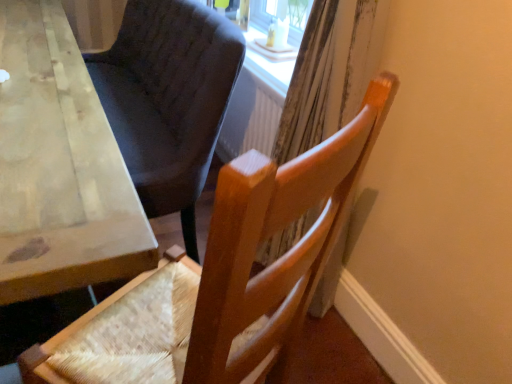
Question: Does wooden chair at center have a larger size compared to wooden table at left?

Choices:
 (A) no
 (B) yes

Answer: (A)

Question: Is wooden chair at center facing away from wooden table at left?

Choices:
 (A) yes
 (B) no

Answer: (B)

Question: Does wooden chair at center lie in front of wooden table at left?

Choices:
 (A) no
 (B) yes

Answer: (B)

Question: Is wooden chair at center next to wooden table at left and touching it?

Choices:
 (A) no
 (B) yes

Answer: (A)

Question: Does wooden chair at center have a greater width compared to wooden table at left?

Choices:
 (A) no
 (B) yes

Answer: (B)

Question: Is wooden table at left located within wooden chair at center?

Choices:
 (A) no
 (B) yes

Answer: (A)

Question: Could you tell me if wooden chair at center is turned towards wooden curtain at right?

Choices:
 (A) yes
 (B) no

Answer: (B)

Question: Does wooden chair at center appear on the right side of wooden curtain at right?

Choices:
 (A) no
 (B) yes

Answer: (A)

Question: Is wooden chair at center positioned before wooden curtain at right?

Choices:
 (A) no
 (B) yes

Answer: (B)

Question: Considering the relative sizes of wooden chair at center and wooden curtain at right in the image provided, is wooden chair at center taller than wooden curtain at right?

Choices:
 (A) yes
 (B) no

Answer: (B)

Question: Considering the relative positions of wooden chair at center and wooden curtain at right in the image provided, is wooden chair at center to the left of wooden curtain at right from the viewer's perspective?

Choices:
 (A) no
 (B) yes

Answer: (B)

Question: From a real-world perspective, is wooden chair at center beneath wooden curtain at right?

Choices:
 (A) no
 (B) yes

Answer: (B)

Question: Is wooden curtain at right thinner than wooden table at left?

Choices:
 (A) no
 (B) yes

Answer: (B)